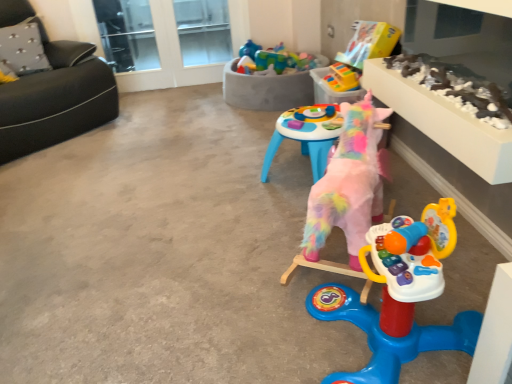
Question: Is multicolored plastic toy at upper center, which is the third toy from back to front, completely or partially inside transparent glass door at upper center?

Choices:
 (A) yes
 (B) no

Answer: (B)

Question: Can you confirm if transparent glass door at upper center is shorter than multicolored plastic toy at upper center, acting as the 3th toy starting from the front?

Choices:
 (A) yes
 (B) no

Answer: (B)

Question: Can you confirm if transparent glass door at upper center is bigger than multicolored plastic toy at upper center, acting as the 3th toy starting from the front?

Choices:
 (A) yes
 (B) no

Answer: (B)

Question: From the image's perspective, is transparent glass door at upper center below multicolored plastic toy at upper center, which is the third toy from back to front?

Choices:
 (A) no
 (B) yes

Answer: (A)

Question: Is transparent glass door at upper center thinner than multicolored plastic toy at upper center, which is the third toy from back to front?

Choices:
 (A) no
 (B) yes

Answer: (B)

Question: Is plush pink unicorn at center, arranged as the fifth toy when viewed from the back, wider or thinner than gray fabric pillow at upper left?

Choices:
 (A) thin
 (B) wide

Answer: (B)

Question: Based on their positions, is plush pink unicorn at center, the 1th toy positioned from the front, located to the left or right of gray fabric pillow at upper left?

Choices:
 (A) right
 (B) left

Answer: (A)

Question: In the image, is plush pink unicorn at center, arranged as the fifth toy when viewed from the back, positioned in front of or behind gray fabric pillow at upper left?

Choices:
 (A) behind
 (B) front

Answer: (B)

Question: Choose the correct answer: Is plush pink unicorn at center, arranged as the fifth toy when viewed from the back, inside gray fabric pillow at upper left or outside it?

Choices:
 (A) outside
 (B) inside

Answer: (A)

Question: From the image's perspective, relative to plush pink unicorn at center, the 1th toy positioned from the front, is multicolored plastic toy at upper center, acting as the 3th toy starting from the front, above or below?

Choices:
 (A) above
 (B) below

Answer: (A)

Question: Considering the positions of multicolored plastic toy at upper center, acting as the 3th toy starting from the front, and plush pink unicorn at center, arranged as the fifth toy when viewed from the back, in the image, is multicolored plastic toy at upper center, acting as the 3th toy starting from the front, taller or shorter than plush pink unicorn at center, arranged as the fifth toy when viewed from the back,?

Choices:
 (A) tall
 (B) short

Answer: (B)

Question: Relative to plush pink unicorn at center, the 1th toy positioned from the front, is multicolored plastic toy at upper center, which is the third toy from back to front, in front or behind?

Choices:
 (A) behind
 (B) front

Answer: (A)

Question: Is multicolored plastic toy at upper center, which is the third toy from back to front, bigger or smaller than plush pink unicorn at center, the 1th toy positioned from the front?

Choices:
 (A) small
 (B) big

Answer: (A)

Question: Is white textured table at upper right in front of or behind transparent glass window at upper center in the image?

Choices:
 (A) behind
 (B) front

Answer: (B)

Question: From the image's perspective, is white textured table at upper right positioned above or below transparent glass window at upper center?

Choices:
 (A) above
 (B) below

Answer: (B)